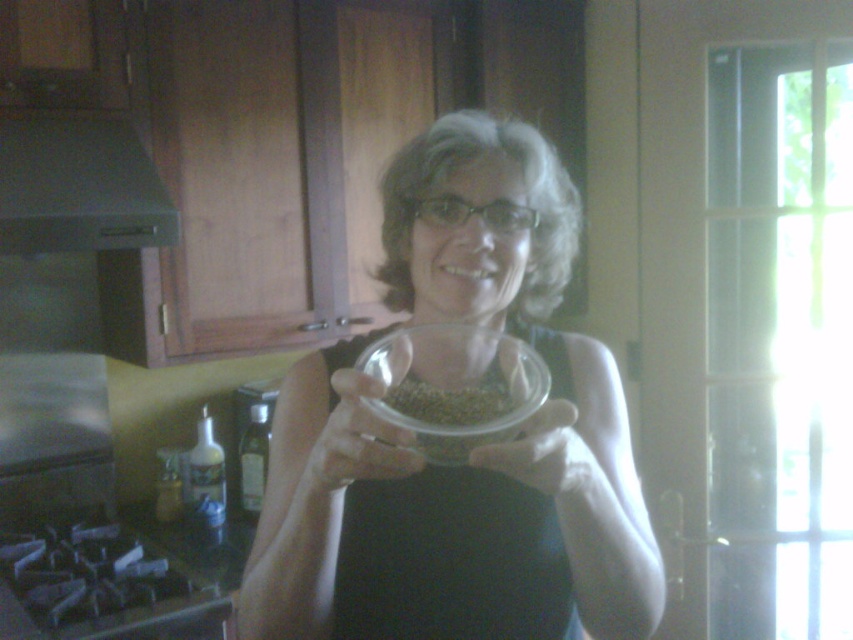
Who is higher up, green matte exhaust hood at upper left or clear plastic bowl at center?

green matte exhaust hood at upper left is above.

Does green matte exhaust hood at upper left have a lesser width compared to clear plastic bowl at center?

No, green matte exhaust hood at upper left is not thinner than clear plastic bowl at center.

Does point (54, 177) come farther from viewer compared to point (409, 454)?

Yes, point (54, 177) is behind point (409, 454).

Where is `green matte exhaust hood at upper left`? green matte exhaust hood at upper left is located at coordinates (78, 186).

Does clear glass bowl at center have a smaller size compared to transparent plastic bowl at center?

No, clear glass bowl at center is not smaller than transparent plastic bowl at center.

The width and height of the screenshot is (853, 640). In order to click on clear glass bowl at center in this screenshot , I will do `click(474, 452)`.

Who is higher up, black fabric apron at center or clear plastic bowl at center?

Positioned higher is clear plastic bowl at center.

Which is more to the left, black fabric apron at center or clear plastic bowl at center?

clear plastic bowl at center

Is point (544, 589) closer to viewer compared to point (339, 442)?

That is False.

You are a GUI agent. You are given a task and a screenshot of the screen. Output one action in this format:
    pyautogui.click(x=<x>, y=<y>)
    Task: Click on the black fabric apron at center
    Image resolution: width=853 pixels, height=640 pixels.
    Given the screenshot: What is the action you would take?
    (x=451, y=561)